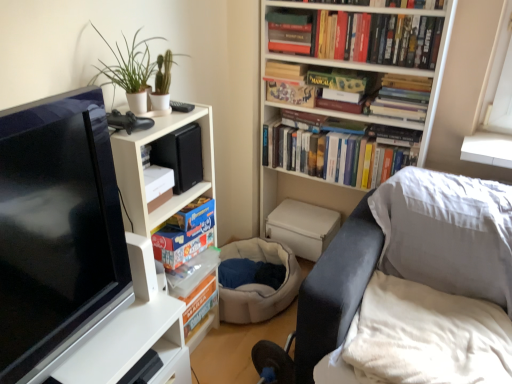
Question: Is green matte plant at upper left aimed at white matte bookcase at upper left, which ranks as the second bookcase in right-to-left order?

Choices:
 (A) yes
 (B) no

Answer: (B)

Question: Is white matte bookcase at upper left, which is the first bookcase from left to right, located within green matte plant at upper left?

Choices:
 (A) no
 (B) yes

Answer: (A)

Question: Is the depth of green matte plant at upper left greater than that of white matte bookcase at upper left, which is the first bookcase from left to right?

Choices:
 (A) yes
 (B) no

Answer: (A)

Question: Is green matte plant at upper left far from white matte bookcase at upper left, which is the first bookcase from left to right?

Choices:
 (A) no
 (B) yes

Answer: (A)

Question: Does green matte plant at upper left have a smaller size compared to white matte bookcase at upper left, which is the first bookcase from left to right?

Choices:
 (A) yes
 (B) no

Answer: (A)

Question: From a real-world perspective, is green matte plant at upper left located higher than white matte bookcase at upper left, which ranks as the second bookcase in right-to-left order?

Choices:
 (A) no
 (B) yes

Answer: (B)

Question: From the image's perspective, would you say white matte bookcase at upper left, which ranks as the second bookcase in right-to-left order, is shown under white soft blanket at lower right?

Choices:
 (A) no
 (B) yes

Answer: (A)

Question: Is white soft blanket at lower right completely or partially inside white matte bookcase at upper left, which is the first bookcase from left to right?

Choices:
 (A) yes
 (B) no

Answer: (B)

Question: Considering the relative sizes of white matte bookcase at upper left, which ranks as the second bookcase in right-to-left order, and white soft blanket at lower right in the image provided, is white matte bookcase at upper left, which ranks as the second bookcase in right-to-left order, thinner than white soft blanket at lower right?

Choices:
 (A) no
 (B) yes

Answer: (B)

Question: Considering the relative positions of white matte bookcase at upper left, which ranks as the second bookcase in right-to-left order, and white soft blanket at lower right in the image provided, is white matte bookcase at upper left, which ranks as the second bookcase in right-to-left order, to the right of white soft blanket at lower right from the viewer's perspective?

Choices:
 (A) yes
 (B) no

Answer: (B)

Question: Is white matte bookcase at upper left, which is the first bookcase from left to right, to the left of white soft blanket at lower right from the viewer's perspective?

Choices:
 (A) no
 (B) yes

Answer: (B)

Question: From a real-world perspective, is white matte bookcase at upper left, which ranks as the second bookcase in right-to-left order, physically above white soft blanket at lower right?

Choices:
 (A) no
 (B) yes

Answer: (B)

Question: Would you say hardcover book at upper center, acting as the 5th book starting from the bottom, contains hardcover books at upper center, the third book in the bottom-to-top sequence?

Choices:
 (A) no
 (B) yes

Answer: (A)